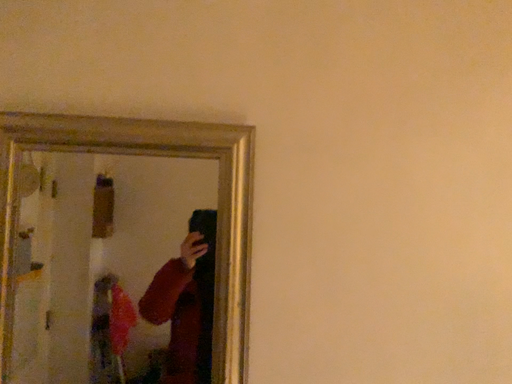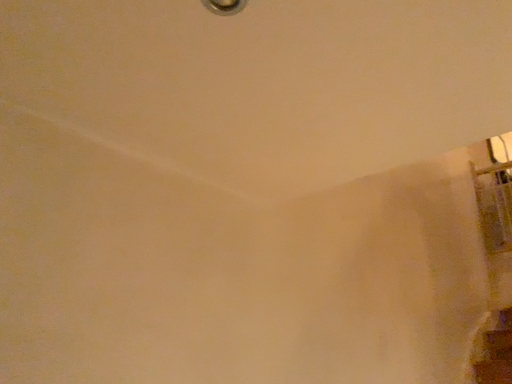
Question: How did the camera likely rotate when shooting the video?

Choices:
 (A) rotated upward
 (B) rotated downward

Answer: (A)